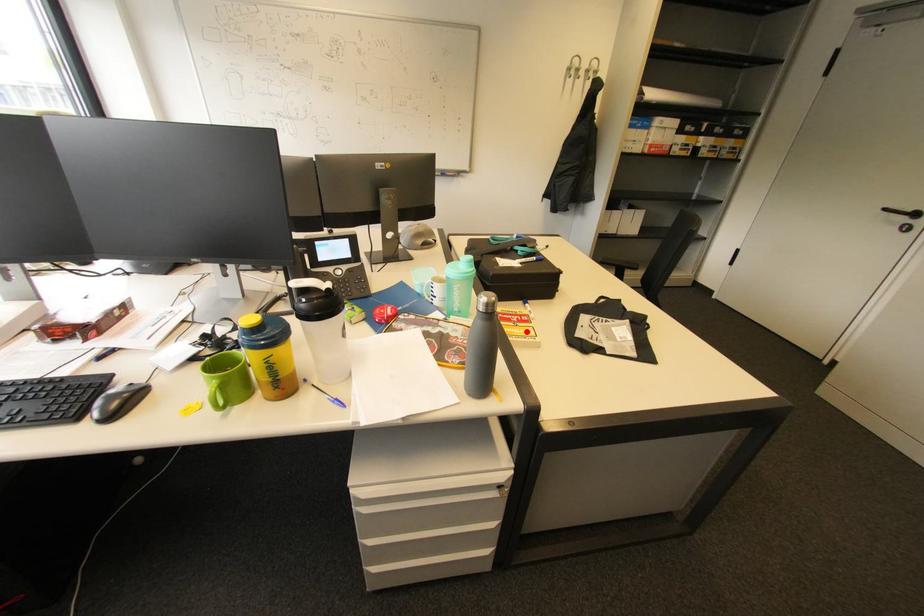
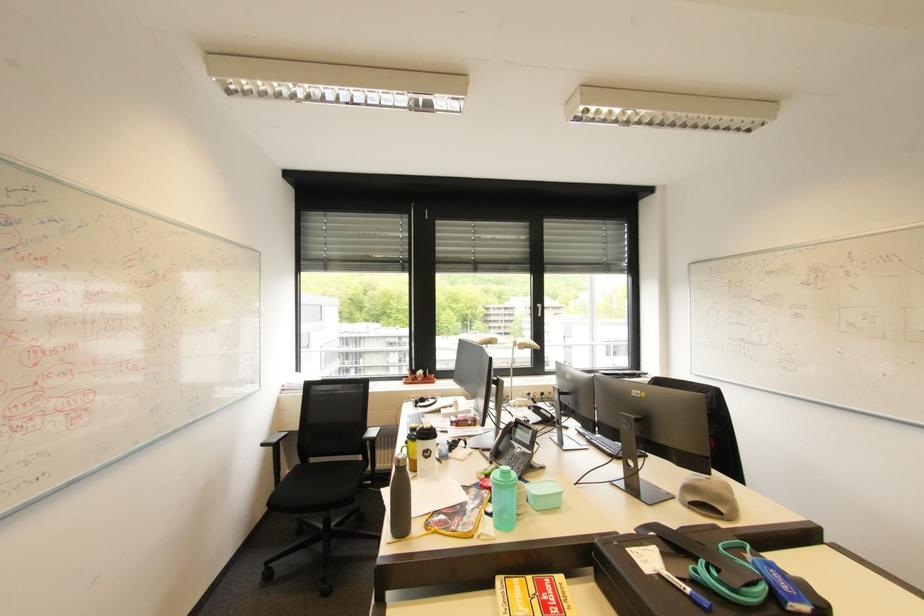
Find the pixel in the second image that matches the highlighted location in the first image.

(526, 602)